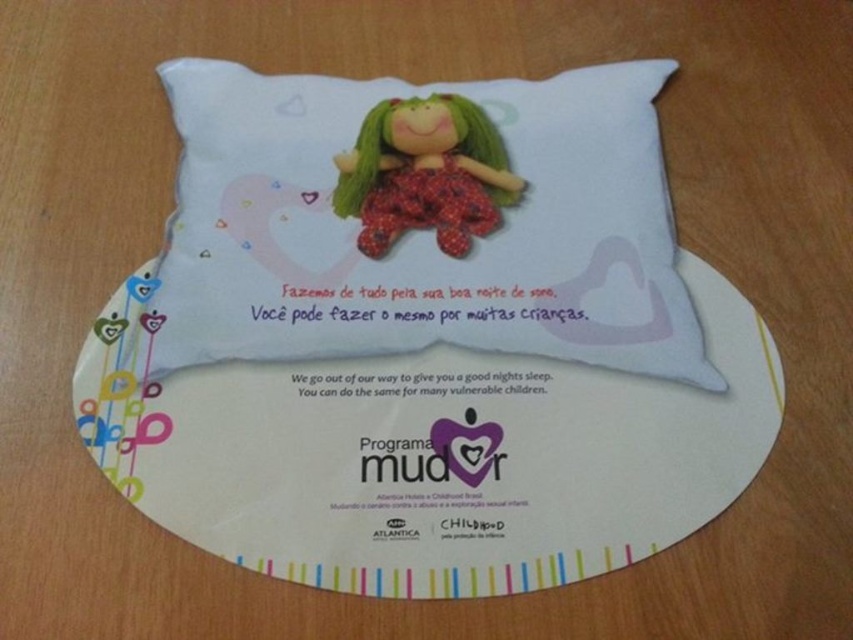
What is the relationship in size between the white soft pillow at center and the white paper plate at center?

The white soft pillow at center is bigger than the white paper plate at center.

What is the relationship between the sizes of the white paper plate at center and the matte plastic doll at center on the pillow design?

The white paper plate at center has a larger size compared to the matte plastic doll at center, so the plate is bigger than the doll.